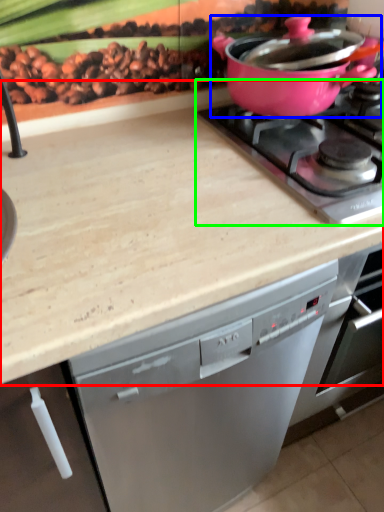
Question: Based on their relative distances, which object is nearer to countertop (highlighted by a red box)? Choose from kitchen appliance (highlighted by a blue box) and gas stove (highlighted by a green box).

Choices:
 (A) kitchen appliance
 (B) gas stove

Answer: (B)